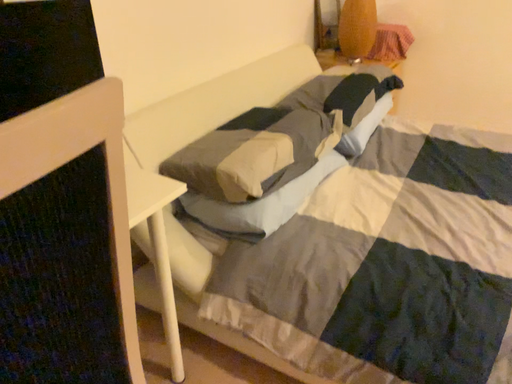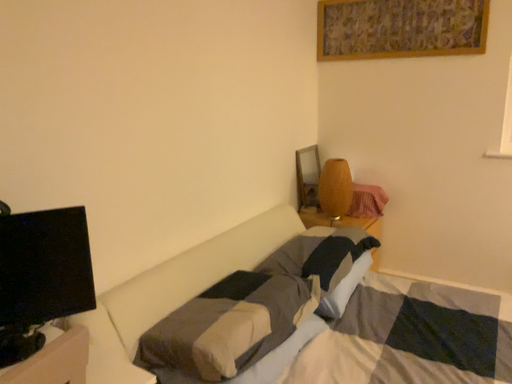
Question: Which way did the camera rotate in the video?

Choices:
 (A) rotated downward
 (B) rotated upward

Answer: (B)